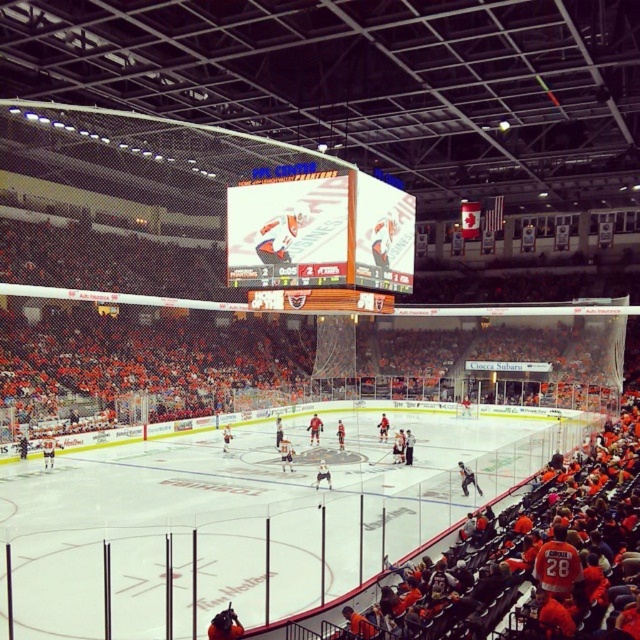
Is white ice at center below shiny black jersey at center?

No.

Where is `white ice at center`? The width and height of the screenshot is (640, 640). white ice at center is located at coordinates (252, 550).

Between point (333, 572) and point (323, 465), which one is positioned behind?

Positioned behind is point (323, 465).

Does white ice at center have a lesser width compared to white glossy jersey at center?

In fact, white ice at center might be wider than white glossy jersey at center.

Is point (88, 637) farther from viewer compared to point (324, 477)?

No, (88, 637) is in front of (324, 477).

In order to click on white ice at center in this screenshot , I will do `click(252, 550)`.

Does shiny black jersey at center have a greater height compared to white glossy jersey at center?

Yes.

Is shiny black jersey at center smaller than white glossy jersey at center?

Actually, shiny black jersey at center might be larger than white glossy jersey at center.

Image resolution: width=640 pixels, height=640 pixels. What are the coordinates of `shiny black jersey at center` in the screenshot? It's located at (467, 477).